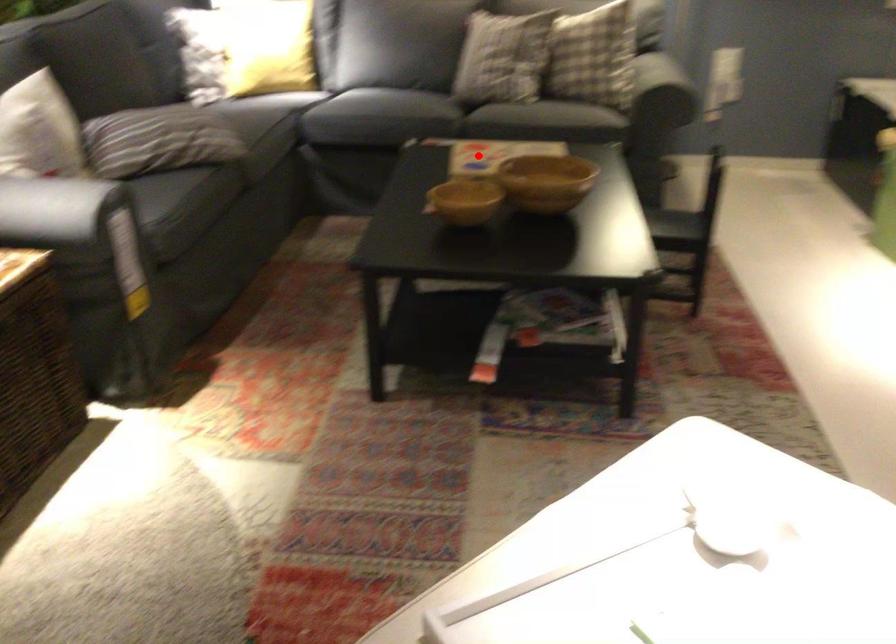
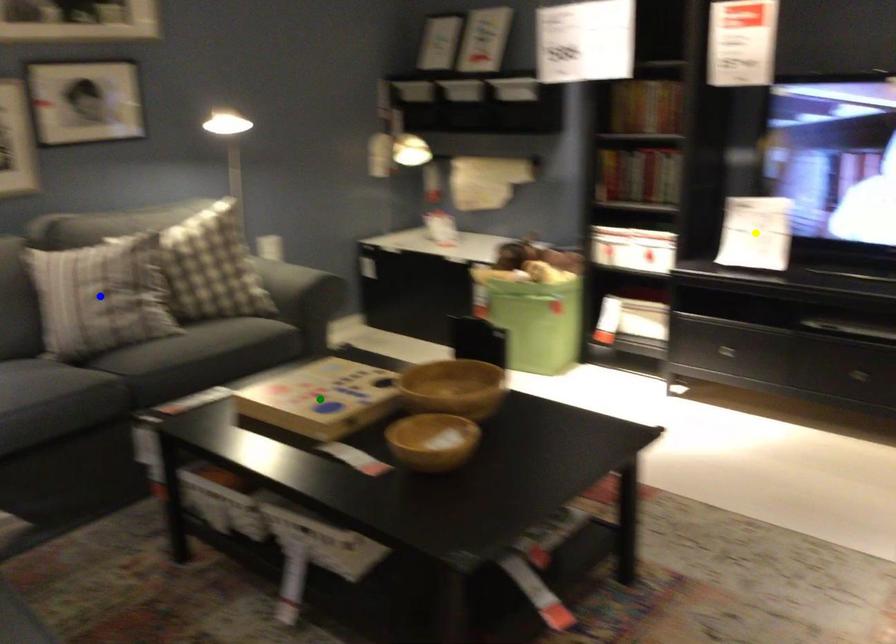
Question: I am providing you with two images of the same scene from different viewpoints. A red point is marked on the first image. You are given multiple points on the second image. Which point in image 2 is actually the same real-world point as the red point in image 1?

Choices:
 (A) blue point
 (B) green point
 (C) yellow point

Answer: (B)